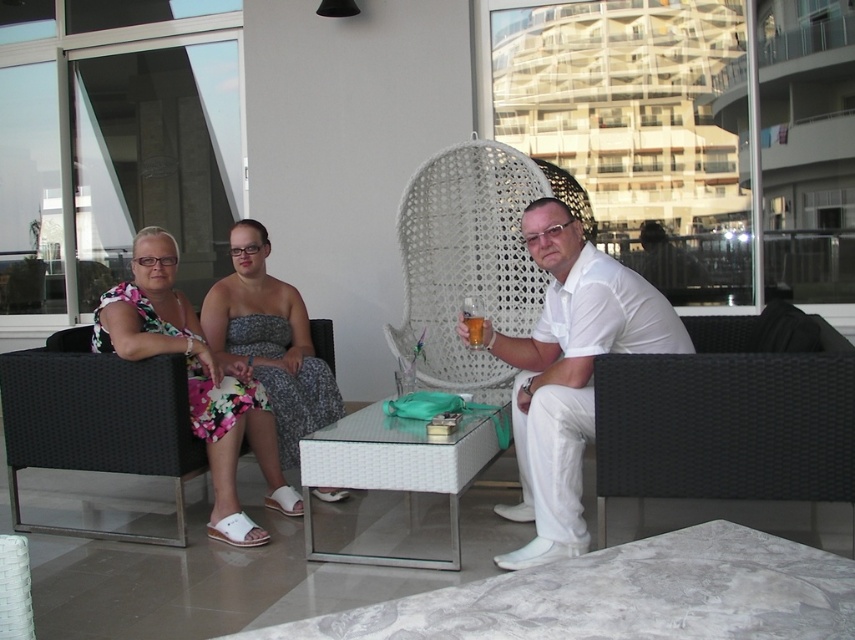
You are standing at the entrance of the lounge and want to approach the transparent glass table at center. Based on your current position, which direction should you walk to reach it?

Since the transparent glass table at center is located at point 0.736 on the x and 0.463 on the y coordinates, you should walk towards the center of the room to reach it.

Consider the image. You are a photographer standing in the lounge area and want to take a photo of the floral fabric dress at center and the translucent glass cup at center. Which object will appear larger in the photo?

The floral fabric dress at center will appear larger in the photo because it is closer to the viewer than the translucent glass cup at center.